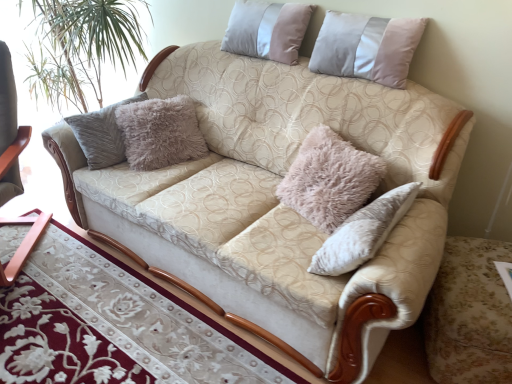
The image size is (512, 384). Identify the location of wooden rocking chair at left. (x=10, y=131).

Identify the location of wooden table at lower left. The image size is (512, 384). (113, 325).

You are a GUI agent. You are given a task and a screenshot of the screen. Output one action in this format:
    pyautogui.click(x=<x>, y=<y>)
    Task: Click on the pale pink velvet pillow at upper right, marked as the second pillow in a left-to-right arrangement
    This screenshot has width=512, height=384.
    Given the screenshot: What is the action you would take?
    pyautogui.click(x=366, y=47)

Which pillow is the 1st one when counting from the back of the wooden table at lower left? Please provide its 2D coordinates.

[(366, 47)]

From a real-world perspective, which object rests below the other?

In real-world perspective, wooden table at lower left is lower.

Is pale pink velvet pillow at upper right, marked as the first pillow in a right-to-left arrangement, not within wooden table at lower left?

That's correct, pale pink velvet pillow at upper right, marked as the first pillow in a right-to-left arrangement, is outside of wooden table at lower left.

Consider the image. Who is shorter, pale pink velvet pillow at upper right, marked as the first pillow in a right-to-left arrangement, or wooden table at lower left?

wooden table at lower left.

Is silky beige pillow at upper center, the first pillow viewed from the left, in contact with wooden rocking chair at left?

silky beige pillow at upper center, the first pillow viewed from the left, and wooden rocking chair at left are clearly separated.

Visually, is silky beige pillow at upper center, the first pillow viewed from the left, positioned to the left or to the right of wooden rocking chair at left?

silky beige pillow at upper center, the first pillow viewed from the left, is positioned on wooden rocking chair at left's right side.

Is silky beige pillow at upper center, the first pillow viewed from the left, turned away from wooden rocking chair at left?

That's not correct — silky beige pillow at upper center, the first pillow viewed from the left, is not looking away from wooden rocking chair at left.

Which of these two, silky beige pillow at upper center, the first pillow viewed from the left, or wooden rocking chair at left, is smaller?

silky beige pillow at upper center, the first pillow viewed from the left, is smaller.

Is wooden rocking chair at left at the back of pale pink velvet pillow at upper right, marked as the second pillow in a left-to-right arrangement?

No, wooden rocking chair at left is not at the back of pale pink velvet pillow at upper right, marked as the second pillow in a left-to-right arrangement.

From the image's perspective, between pale pink velvet pillow at upper right, marked as the first pillow in a right-to-left arrangement, and wooden rocking chair at left, who is located below?

wooden rocking chair at left.

Is pale pink velvet pillow at upper right, marked as the first pillow in a right-to-left arrangement, inside or outside of wooden rocking chair at left?

pale pink velvet pillow at upper right, marked as the first pillow in a right-to-left arrangement, lies outside wooden rocking chair at left.

Identify the location of rocking chair in front of the pale pink velvet pillow at upper right, marked as the first pillow in a right-to-left arrangement. The width and height of the screenshot is (512, 384). (10, 131).

Would you say wooden rocking chair at left is outside pale pink velvet pillow at upper right, marked as the first pillow in a right-to-left arrangement?

wooden rocking chair at left is positioned outside pale pink velvet pillow at upper right, marked as the first pillow in a right-to-left arrangement.

From a real-world perspective, is wooden rocking chair at left over pale pink velvet pillow at upper right, marked as the first pillow in a right-to-left arrangement?

Actually, wooden rocking chair at left is physically below pale pink velvet pillow at upper right, marked as the first pillow in a right-to-left arrangement, in the real world.

Is wooden table at lower left turned away from silky beige pillow at upper center, placed as the second pillow when sorted from right to left?

No, silky beige pillow at upper center, placed as the second pillow when sorted from right to left, is not at the back of wooden table at lower left.

Which of these two, wooden table at lower left or silky beige pillow at upper center, the first pillow viewed from the left, is smaller?

Smaller between the two is silky beige pillow at upper center, the first pillow viewed from the left.

From the image's perspective, which is above, wooden table at lower left or silky beige pillow at upper center, placed as the second pillow when sorted from right to left?

From the image's view, silky beige pillow at upper center, placed as the second pillow when sorted from right to left, is above.

Which point is more forward, (42, 354) or (243, 14)?

The point (42, 354) is in front.

Between pale pink velvet pillow at upper right, marked as the second pillow in a left-to-right arrangement, and silky beige pillow at upper center, the first pillow viewed from the left, which one has less height?

silky beige pillow at upper center, the first pillow viewed from the left, is shorter.

How many degrees apart are the facing directions of pale pink velvet pillow at upper right, marked as the second pillow in a left-to-right arrangement, and silky beige pillow at upper center, placed as the second pillow when sorted from right to left?

pale pink velvet pillow at upper right, marked as the second pillow in a left-to-right arrangement, and silky beige pillow at upper center, placed as the second pillow when sorted from right to left, are facing 0.0513 degrees away from each other.

Is pale pink velvet pillow at upper right, marked as the second pillow in a left-to-right arrangement, in contact with silky beige pillow at upper center, the first pillow viewed from the left?

They are not placed beside each other.

Visually, is pale pink velvet pillow at upper right, marked as the second pillow in a left-to-right arrangement, positioned to the left or to the right of silky beige pillow at upper center, the first pillow viewed from the left?

In the image, pale pink velvet pillow at upper right, marked as the second pillow in a left-to-right arrangement, appears on the right side of silky beige pillow at upper center, the first pillow viewed from the left.

From the image's perspective, which one is positioned higher, silky beige pillow at upper center, the first pillow viewed from the left, or pale pink velvet pillow at upper right, marked as the second pillow in a left-to-right arrangement?

silky beige pillow at upper center, the first pillow viewed from the left, from the image's perspective.

Which object is wider, silky beige pillow at upper center, the first pillow viewed from the left, or pale pink velvet pillow at upper right, marked as the first pillow in a right-to-left arrangement?

With larger width is pale pink velvet pillow at upper right, marked as the first pillow in a right-to-left arrangement.

At what (x,y) coordinates should I click in order to perform the action: click on pillow on the right of silky beige pillow at upper center, the first pillow viewed from the left. Please return your answer as a coordinate pair (x, y). The height and width of the screenshot is (384, 512). Looking at the image, I should click on [366, 47].

Could you measure the distance between silky beige pillow at upper center, placed as the second pillow when sorted from right to left, and pale pink velvet pillow at upper right, marked as the second pillow in a left-to-right arrangement?

silky beige pillow at upper center, placed as the second pillow when sorted from right to left, and pale pink velvet pillow at upper right, marked as the second pillow in a left-to-right arrangement, are 12.95 inches apart.

Where is `table below the pale pink velvet pillow at upper right, marked as the first pillow in a right-to-left arrangement (from a real-world perspective)`? Image resolution: width=512 pixels, height=384 pixels. table below the pale pink velvet pillow at upper right, marked as the first pillow in a right-to-left arrangement (from a real-world perspective) is located at coordinates (113, 325).

The width and height of the screenshot is (512, 384). Find the location of `the 1st pillow to the right of the wooden rocking chair at left, starting your count from the anchor`. the 1st pillow to the right of the wooden rocking chair at left, starting your count from the anchor is located at coordinates (267, 30).

Which object lies further to the anchor point silky beige pillow at upper center, the first pillow viewed from the left, pale pink velvet pillow at upper right, marked as the first pillow in a right-to-left arrangement, or wooden table at lower left?

The object further to silky beige pillow at upper center, the first pillow viewed from the left, is wooden table at lower left.

Looking at the image, which one is located closer to wooden table at lower left, silky beige pillow at upper center, placed as the second pillow when sorted from right to left, or wooden rocking chair at left?

Based on the image, wooden rocking chair at left appears to be nearer to wooden table at lower left.

Estimate the real-world distances between objects in this image. Which object is closer to wooden table at lower left, wooden rocking chair at left or silky beige pillow at upper center, placed as the second pillow when sorted from right to left?

wooden rocking chair at left.

Which object lies further to the anchor point wooden rocking chair at left, silky beige pillow at upper center, placed as the second pillow when sorted from right to left, or wooden table at lower left?

The object further to wooden rocking chair at left is silky beige pillow at upper center, placed as the second pillow when sorted from right to left.

Estimate the real-world distances between objects in this image. Which object is further from pale pink velvet pillow at upper right, marked as the first pillow in a right-to-left arrangement, silky beige pillow at upper center, the first pillow viewed from the left, or wooden rocking chair at left?

wooden rocking chair at left is positioned further to the anchor pale pink velvet pillow at upper right, marked as the first pillow in a right-to-left arrangement.

When comparing their distances from silky beige pillow at upper center, the first pillow viewed from the left, does wooden table at lower left or pale pink velvet pillow at upper right, marked as the first pillow in a right-to-left arrangement, seem closer?

Among the two, pale pink velvet pillow at upper right, marked as the first pillow in a right-to-left arrangement, is located nearer to silky beige pillow at upper center, the first pillow viewed from the left.

Which object lies nearer to the anchor point pale pink velvet pillow at upper right, marked as the first pillow in a right-to-left arrangement, wooden table at lower left or wooden rocking chair at left?

wooden table at lower left.

Considering their positions, is wooden table at lower left positioned closer to pale pink velvet pillow at upper right, marked as the second pillow in a left-to-right arrangement, than silky beige pillow at upper center, the first pillow viewed from the left?

The object closer to pale pink velvet pillow at upper right, marked as the second pillow in a left-to-right arrangement, is silky beige pillow at upper center, the first pillow viewed from the left.

The height and width of the screenshot is (384, 512). Identify the location of pillow between wooden rocking chair at left and pale pink velvet pillow at upper right, marked as the first pillow in a right-to-left arrangement, in the horizontal direction. (267, 30).

Where is `table between wooden rocking chair at left and pale pink velvet pillow at upper right, marked as the first pillow in a right-to-left arrangement, from left to right`? The image size is (512, 384). table between wooden rocking chair at left and pale pink velvet pillow at upper right, marked as the first pillow in a right-to-left arrangement, from left to right is located at coordinates (113, 325).

This screenshot has height=384, width=512. Find the location of `pillow between silky beige pillow at upper center, the first pillow viewed from the left, and wooden table at lower left in the up-down direction`. pillow between silky beige pillow at upper center, the first pillow viewed from the left, and wooden table at lower left in the up-down direction is located at coordinates (366, 47).

What are the coordinates of `table between wooden rocking chair at left and silky beige pillow at upper center, the first pillow viewed from the left` in the screenshot? It's located at tap(113, 325).